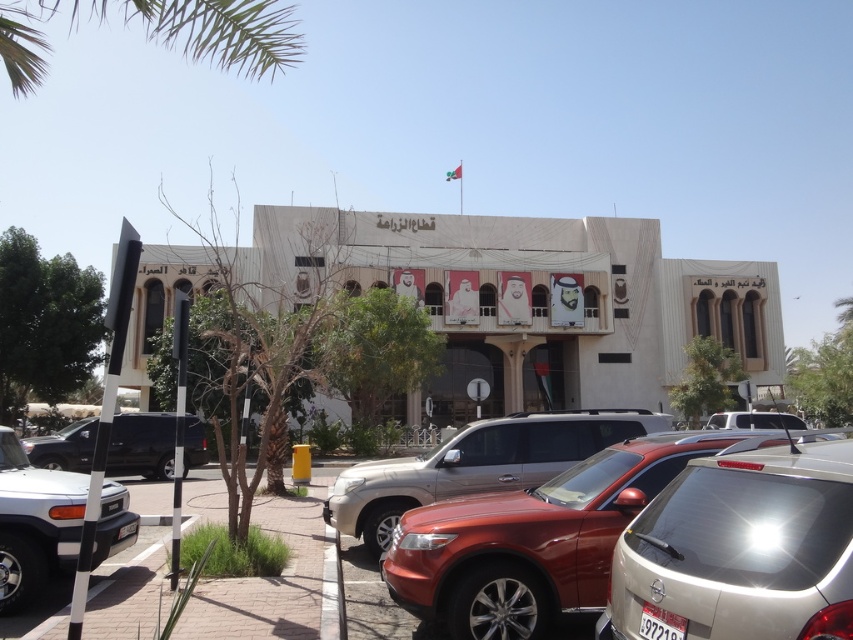
From the picture: Can you confirm if green leafy palm at upper left is smaller than shiny black suv at lower left?

No.

Is point (161, 32) positioned before point (64, 464)?

No, it is not.

This screenshot has height=640, width=853. Find the location of `green leafy palm at upper left`. green leafy palm at upper left is located at coordinates (160, 33).

Can you confirm if metallic silver suv at center is bigger than shiny black suv at lower left?

Yes, metallic silver suv at center is bigger than shiny black suv at lower left.

Who is shorter, metallic silver suv at center or shiny black suv at lower left?

Standing shorter between the two is shiny black suv at lower left.

Which is in front, point (335, 488) or point (149, 454)?

Point (335, 488) is more forward.

Locate an element on the screen. metallic silver suv at center is located at coordinates (476, 465).

Can you confirm if shiny black suv at lower left is thinner than white matte car at center?

Yes, shiny black suv at lower left is thinner than white matte car at center.

Who is taller, shiny black suv at lower left or white matte car at center?

shiny black suv at lower left is taller.

Describe the element at coordinates (141, 445) in the screenshot. I see `shiny black suv at lower left` at that location.

Image resolution: width=853 pixels, height=640 pixels. Identify the location of shiny black suv at lower left. (141, 445).